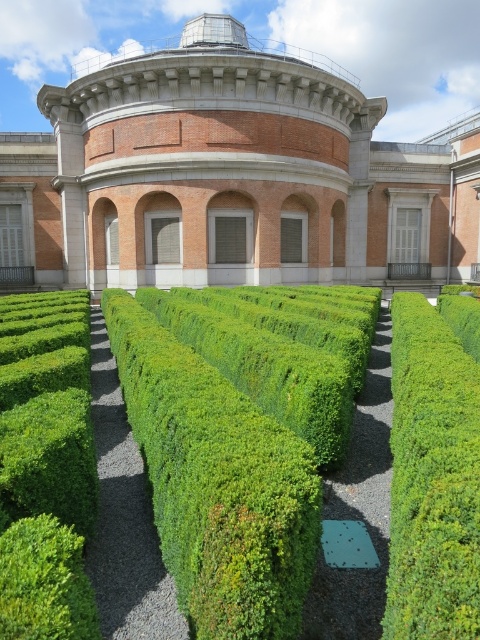
Between brick wall at center and green leafy bush at center, which one appears on the right side from the viewer's perspective?

green leafy bush at center is more to the right.

Is brick wall at center thinner than green leafy bush at center?

Incorrect, brick wall at center's width is not less than green leafy bush at center's.

Is point (90, 184) closer to viewer compared to point (474, 538)?

No, it is behind (474, 538).

The width and height of the screenshot is (480, 640). In order to click on brick wall at center in this screenshot , I will do `click(229, 173)`.

Who is higher up, brick wall at center or green leafy bush at left?

brick wall at center is above.

Is brick wall at center wider than green leafy bush at left?

Yes.

Describe the element at coordinates (229, 173) in the screenshot. Image resolution: width=480 pixels, height=640 pixels. I see `brick wall at center` at that location.

Identify the location of brick wall at center. (229, 173).

Is point (160, 452) behind point (33, 620)?

Yes, it is.

Is point (428, 420) positioned after point (62, 380)?

No.

Where is `green leafy hedge at center`? green leafy hedge at center is located at coordinates (228, 465).